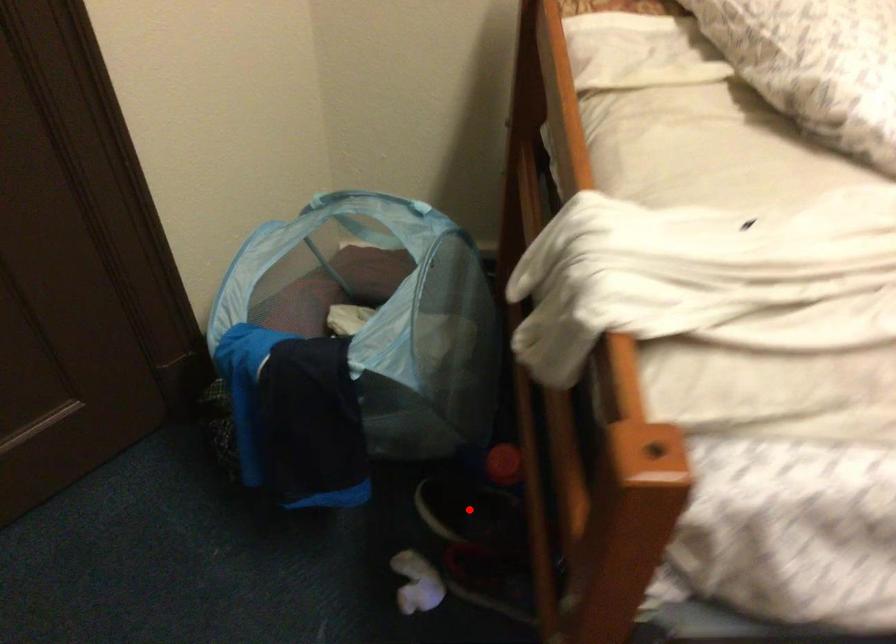
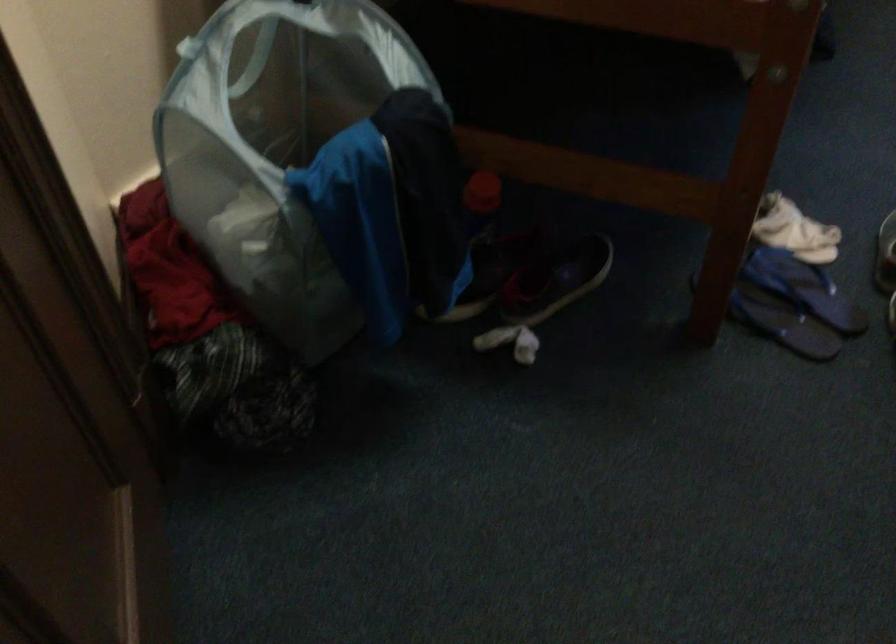
Question: I am providing you with two images of the same scene from different viewpoints. A red point is marked on the first image. At the location where the point appears in image 1, is it still visible in image 2?

Choices:
 (A) Yes
 (B) No

Answer: (B)